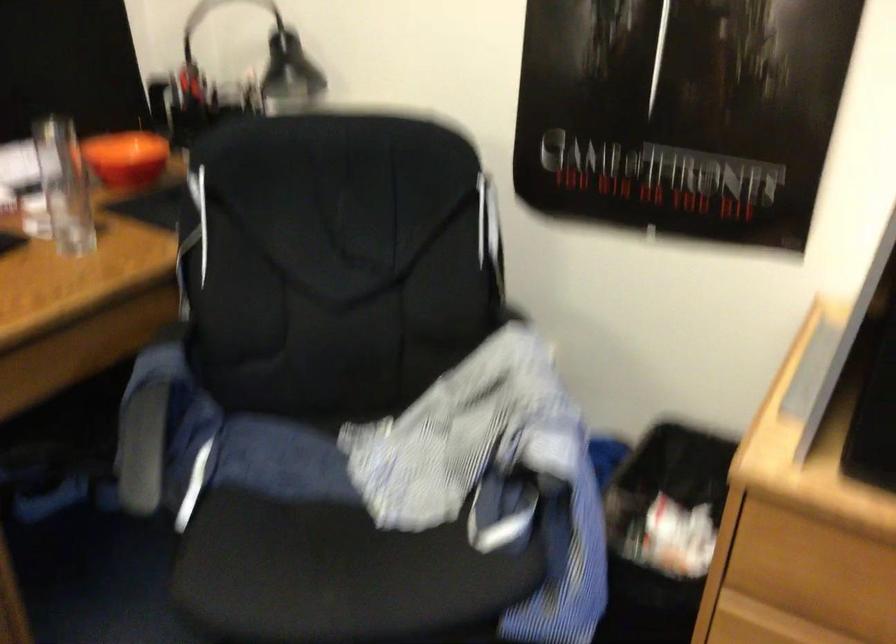
What do you see at coordinates (142, 448) in the screenshot? This screenshot has height=644, width=896. I see `the chair armrest` at bounding box center [142, 448].